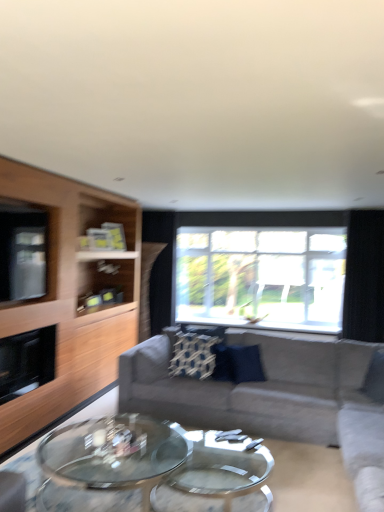
This screenshot has width=384, height=512. What do you see at coordinates (272, 392) in the screenshot? I see `gray fabric couch at center` at bounding box center [272, 392].

Locate an element on the screen. The width and height of the screenshot is (384, 512). black fabric curtain at right is located at coordinates (364, 277).

The width and height of the screenshot is (384, 512). Describe the element at coordinates (107, 463) in the screenshot. I see `transparent glass coffee table at center` at that location.

Locate an element on the screen. light wood entertainment center at left is located at coordinates (71, 297).

Locate an element on the screen. The width and height of the screenshot is (384, 512). transparent glass window at center is located at coordinates (252, 259).

You are a GUI agent. You are given a task and a screenshot of the screen. Output one action in this format:
    pyautogui.click(x=<x>, y=<y>)
    Task: Click on the gray fabric couch at center
    
    Given the screenshot: What is the action you would take?
    pyautogui.click(x=272, y=392)

Considering the relative sizes of black matte fireplace at left and transparent glass coffee table at center in the image provided, is black matte fireplace at left bigger than transparent glass coffee table at center?

Actually, black matte fireplace at left might be smaller than transparent glass coffee table at center.

Is black matte fireplace at left inside or outside of transparent glass coffee table at center?

black matte fireplace at left cannot be found inside transparent glass coffee table at center.

Between black matte fireplace at left and transparent glass coffee table at center, which one has more height?

black matte fireplace at left is taller.

Is there a large distance between clear glass window screen at left and gray fabric couch at center?

clear glass window screen at left is far away from gray fabric couch at center.

The image size is (384, 512). I want to click on studio couch on the right of clear glass window screen at left, so click(x=272, y=392).

Is clear glass window screen at left not inside gray fabric couch at center?

clear glass window screen at left is positioned outside gray fabric couch at center.

Is clear glass window screen at left positioned with its back to gray fabric couch at center?

No.

Does point (34, 261) appear closer or farther from the camera than point (310, 219)?

Point (34, 261) appears to be closer to the viewer than point (310, 219).

Identify the location of window screen that appears on the left of transparent glass window at center. (23, 253).

From the image's perspective, which is above, clear glass window screen at left or transparent glass window at center?

clear glass window screen at left is shown above in the image.

Are black matte fireplace at left and light wood entertainment center at left making contact?

black matte fireplace at left is not next to light wood entertainment center at left, and they're not touching.

Is black matte fireplace at left oriented towards light wood entertainment center at left?

Yes, black matte fireplace at left is facing light wood entertainment center at left.

Considering the points (46, 351) and (36, 195), which point is behind, point (46, 351) or point (36, 195)?

The point (46, 351) is more distant.

Is there a large distance between black fabric curtain at right and gray fabric couch at center?

Absolutely, black fabric curtain at right is distant from gray fabric couch at center.

From a real-world perspective, which is physically below, black fabric curtain at right or gray fabric couch at center?

gray fabric couch at center is physically lower.

Considering the sizes of black fabric curtain at right and gray fabric couch at center in the image, is black fabric curtain at right wider or thinner than gray fabric couch at center?

In the image, black fabric curtain at right appears to be more narrow than gray fabric couch at center.

Would you say black matte fireplace at left is part of transparent glass coffee table at center's contents?

Definitely not — black matte fireplace at left is not inside transparent glass coffee table at center.

From the picture: Can you confirm if transparent glass coffee table at center is shorter than black matte fireplace at left?

Yes.

Is transparent glass coffee table at center directly adjacent to black matte fireplace at left?

transparent glass coffee table at center and black matte fireplace at left are not in contact.

From the image's perspective, is transparent glass coffee table at center on top of black matte fireplace at left?

Incorrect, from the image's perspective, transparent glass coffee table at center is lower than black matte fireplace at left.

Who is shorter, light wood entertainment center at left or navy blue fabric pillow at center?

navy blue fabric pillow at center is shorter.

Is light wood entertainment center at left with navy blue fabric pillow at center?

light wood entertainment center at left and navy blue fabric pillow at center are clearly separated.

In the scene shown: How many degrees apart are the facing directions of light wood entertainment center at left and navy blue fabric pillow at center?

There is a 52.1-degree angle between the facing directions of light wood entertainment center at left and navy blue fabric pillow at center.

Which is more to the left, light wood entertainment center at left or navy blue fabric pillow at center?

light wood entertainment center at left is more to the left.

This screenshot has height=512, width=384. What are the coordinates of `fireplace located on the left of transparent glass coffee table at center` in the screenshot? It's located at (26, 362).

Where is `window screen above the gray fabric couch at center (from a real-world perspective)`? The image size is (384, 512). window screen above the gray fabric couch at center (from a real-world perspective) is located at coordinates (23, 253).

Looking at this image, from the image, which object appears to be farther from black matte fireplace at left, black fabric curtain at right or clear glass window screen at left?

Based on the image, black fabric curtain at right appears to be further to black matte fireplace at left.

From the image, which object appears to be farther from gray fabric couch at center, transparent glass window at center or clear glass window screen at left?

Based on the image, clear glass window screen at left appears to be further to gray fabric couch at center.

Looking at the image, which one is located further to light wood entertainment center at left, transparent glass window at center or black matte fireplace at left?

transparent glass window at center is further to light wood entertainment center at left.

When comparing their distances from black fabric curtain at right, does light wood entertainment center at left or black matte fireplace at left seem closer?

light wood entertainment center at left lies closer to black fabric curtain at right than the other object.

When comparing their distances from clear glass window screen at left, does transparent glass window at center or navy blue fabric pillow at center seem closer?

navy blue fabric pillow at center.

Based on their spatial positions, is black matte fireplace at left or black fabric curtain at right closer to light wood entertainment center at left?

black matte fireplace at left.

Based on their spatial positions, is light wood entertainment center at left or black fabric curtain at right closer to transparent glass window at center?

black fabric curtain at right lies closer to transparent glass window at center than the other object.

Looking at the image, which one is located closer to transparent glass coffee table at center, clear glass window screen at left or black matte fireplace at left?

black matte fireplace at left is positioned closer to the anchor transparent glass coffee table at center.

Locate an element on the screen. This screenshot has height=512, width=384. pillow located between black matte fireplace at left and transparent glass window at center in the depth direction is located at coordinates (237, 364).

Identify the location of entertainment center between gray fabric couch at center and transparent glass window at center from front to back. (71, 297).

Where is `window screen between black matte fireplace at left and black fabric curtain at right from left to right`? The image size is (384, 512). window screen between black matte fireplace at left and black fabric curtain at right from left to right is located at coordinates (23, 253).

Where is `fireplace located between transparent glass coffee table at center and navy blue fabric pillow at center in the depth direction`? The height and width of the screenshot is (512, 384). fireplace located between transparent glass coffee table at center and navy blue fabric pillow at center in the depth direction is located at coordinates (26, 362).